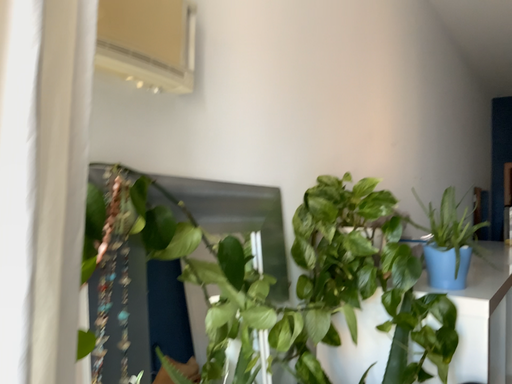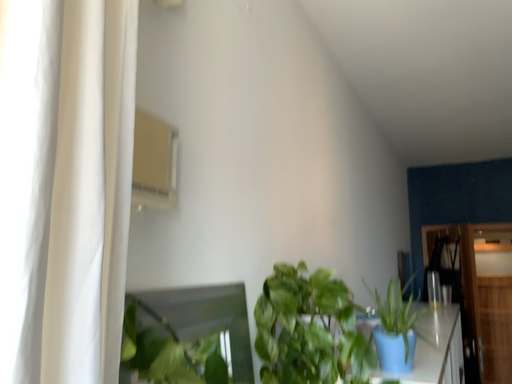
Question: Which way did the camera rotate in the video?

Choices:
 (A) rotated downward
 (B) rotated upward

Answer: (B)